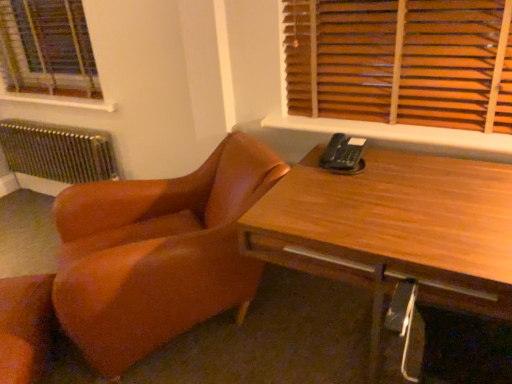
You are a GUI agent. You are given a task and a screenshot of the screen. Output one action in this format:
    pyautogui.click(x=<x>, y=<y>)
    Task: Click on the vacant area situated below wooden blinds at upper right (from a real-world perspective)
    The width and height of the screenshot is (512, 384).
    Given the screenshot: What is the action you would take?
    pyautogui.click(x=394, y=117)